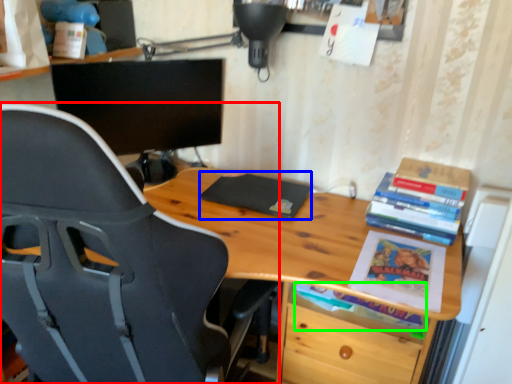
Question: Which object is positioned farthest from chair (highlighted by a red box)? Select from paperback book (highlighted by a blue box) and book (highlighted by a green box).

Choices:
 (A) paperback book
 (B) book

Answer: (A)